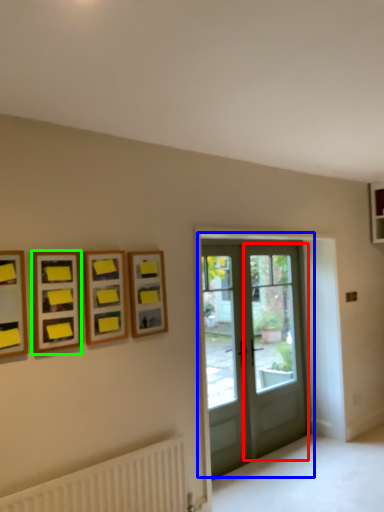
Question: Which is nearer to the screen door (highlighted by a red box)? door (highlighted by a blue box) or picture frame (highlighted by a green box).

Choices:
 (A) door
 (B) picture frame

Answer: (A)